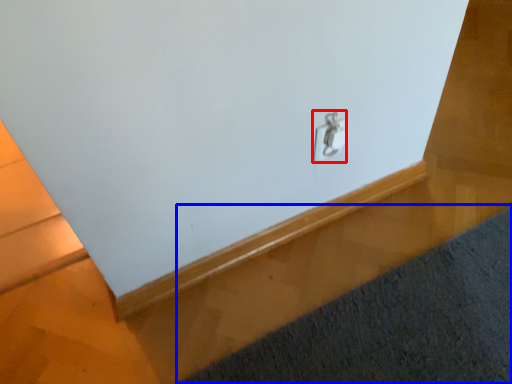
Question: Which of the following is the closest to the observer, lock (highlighted by a red box) or mat (highlighted by a blue box)?

Choices:
 (A) lock
 (B) mat

Answer: (B)